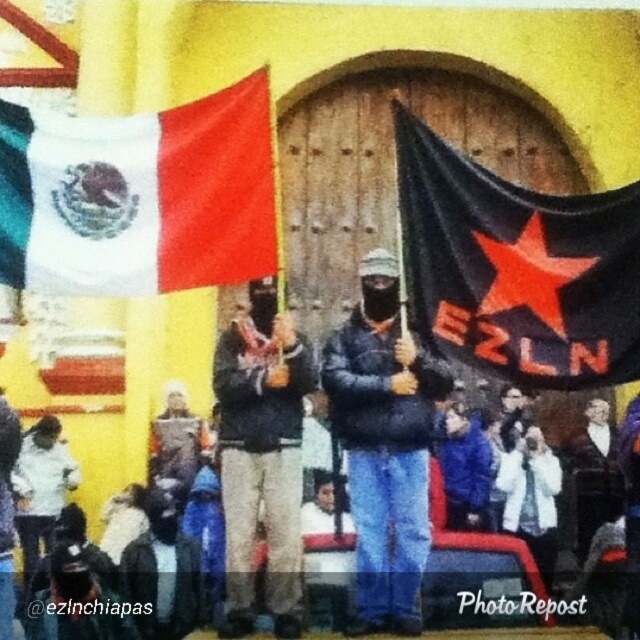
Question: Which object is the closest to the dark blue jacket at lower center?

Choices:
 (A) white fabric flag at upper left
 (B) matte black jacket at center
 (C) dark gray fabric jacket at center

Answer: (B)

Question: Is white fabric flag at upper left positioned behind dark gray fabric jacket at center?

Choices:
 (A) yes
 (B) no

Answer: (B)

Question: Which of the following is the closest to the observer?

Choices:
 (A) (250, 435)
 (B) (500, 365)
 (C) (266, 211)
 (D) (348, 326)

Answer: (B)

Question: Can you confirm if white fabric flag at upper left is smaller than dark blue jacket at lower center?

Choices:
 (A) no
 (B) yes

Answer: (B)

Question: Is white fabric flag at upper left closer to camera compared to black fabric banner at center?

Choices:
 (A) no
 (B) yes

Answer: (A)

Question: Among these objects, which one is farthest from the camera?

Choices:
 (A) dark blue jacket at lower center
 (B) white fabric flag at upper left

Answer: (A)